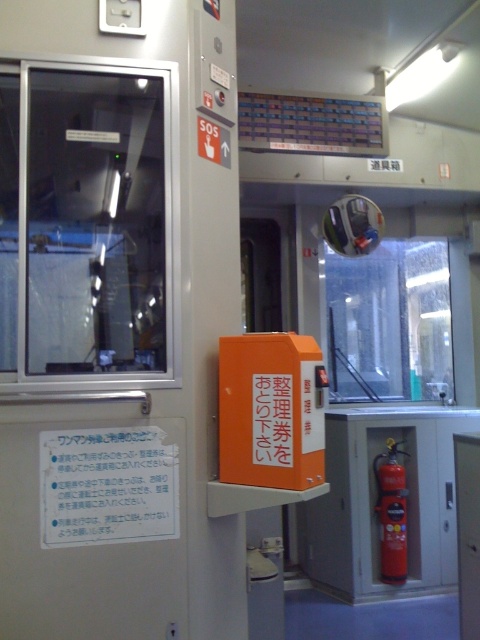
Question: Is transparent glass door at upper left to the right of red matte fire extinguisher at right from the viewer's perspective?

Choices:
 (A) no
 (B) yes

Answer: (A)

Question: Can you confirm if transparent glass door at upper left is positioned above red matte fire extinguisher at right?

Choices:
 (A) no
 (B) yes

Answer: (B)

Question: Does transparent glass door at upper left have a larger size compared to red matte fire extinguisher at right?

Choices:
 (A) yes
 (B) no

Answer: (A)

Question: Which point is closer to the camera taking this photo?

Choices:
 (A) (144, 99)
 (B) (400, 518)

Answer: (A)

Question: Among these points, which one is nearest to the camera?

Choices:
 (A) (400, 442)
 (B) (15, 564)

Answer: (B)